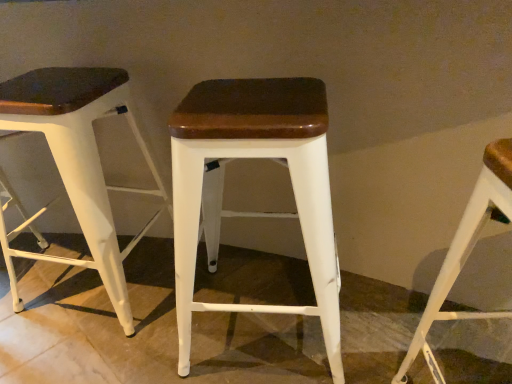
Question: Does white matte wood stool at center, which appears as the 2th stool when viewed from the left, have a lesser height compared to white matte wood stool at center, which is the first stool from left to right?

Choices:
 (A) no
 (B) yes

Answer: (B)

Question: Is white matte wood stool at center, which appears as the 2th stool when viewed from the left, in front of white matte wood stool at center, which is the first stool from left to right?

Choices:
 (A) yes
 (B) no

Answer: (A)

Question: From the image's perspective, does white matte wood stool at center, which appears as the 2th stool when viewed from the left, appear higher than white matte wood stool at center, the 3th stool viewed from the right?

Choices:
 (A) yes
 (B) no

Answer: (B)

Question: Does white matte wood stool at center, which appears as the 2th stool when viewed from the left, appear on the left side of white matte wood stool at center, which is the first stool from left to right?

Choices:
 (A) no
 (B) yes

Answer: (A)

Question: Is white matte wood stool at center, which appears as the 2th stool when viewed from the left, beside white matte wood stool at center, which is the first stool from left to right?

Choices:
 (A) yes
 (B) no

Answer: (B)

Question: Does point (197, 119) appear closer or farther from the camera than point (118, 304)?

Choices:
 (A) closer
 (B) farther

Answer: (A)

Question: In the image, is white matte wood stool at center, which appears as the 2th stool when viewed from the left, on the left side or the right side of white matte wood stool at center, the 3th stool viewed from the right?

Choices:
 (A) right
 (B) left

Answer: (A)

Question: From a real-world perspective, is white matte wood stool at center, which appears as the 2th stool when viewed from the left, above or below white matte wood stool at center, the 3th stool viewed from the right?

Choices:
 (A) above
 (B) below

Answer: (B)

Question: In terms of height, does white matte wood stool at center, which appears as the 2th stool when viewed from the left, look taller or shorter compared to white matte wood stool at center, the 3th stool viewed from the right?

Choices:
 (A) tall
 (B) short

Answer: (B)

Question: In terms of width, does white matte wood stool at center, which is the first stool from left to right, look wider or thinner when compared to white matte wood stool at center, which appears as the 2th stool when viewed from the left?

Choices:
 (A) wide
 (B) thin

Answer: (B)

Question: Looking at the image, does white matte wood stool at center, the 3th stool viewed from the right, seem bigger or smaller compared to white matte wood stool at center, arranged as the second stool when viewed from the right?

Choices:
 (A) small
 (B) big

Answer: (A)

Question: Would you say white matte wood stool at center, which is the first stool from left to right, is to the left or to the right of white matte wood stool at center, arranged as the second stool when viewed from the right, in the picture?

Choices:
 (A) right
 (B) left

Answer: (B)

Question: Is point (10, 89) closer or farther from the camera than point (291, 168)?

Choices:
 (A) closer
 (B) farther

Answer: (B)

Question: Is white matte stool at right, acting as the 1th stool starting from the right, in front of or behind white matte wood stool at center, the 3th stool viewed from the right, in the image?

Choices:
 (A) behind
 (B) front

Answer: (B)

Question: Considering the positions of white matte stool at right, which ranks as the 3th stool in left-to-right order, and white matte wood stool at center, the 3th stool viewed from the right, in the image, is white matte stool at right, which ranks as the 3th stool in left-to-right order, taller or shorter than white matte wood stool at center, the 3th stool viewed from the right,?

Choices:
 (A) short
 (B) tall

Answer: (A)